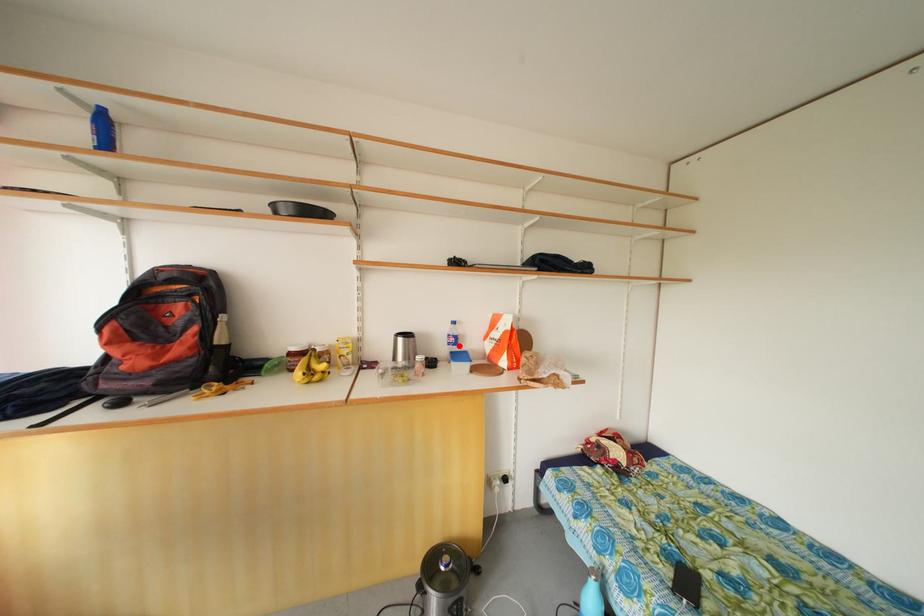
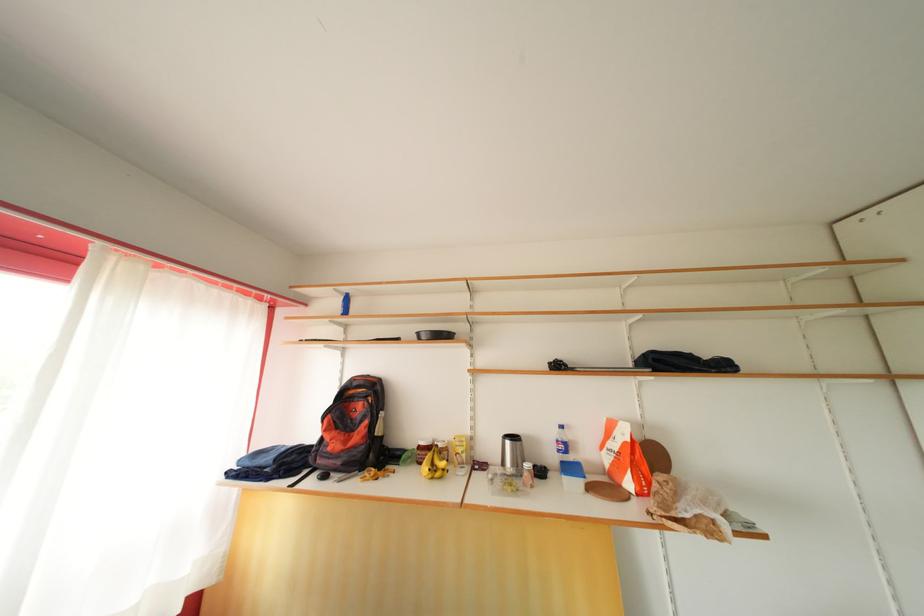
The point at the highlighted location is marked in the first image. Where is the corresponding point in the second image?

(568, 453)